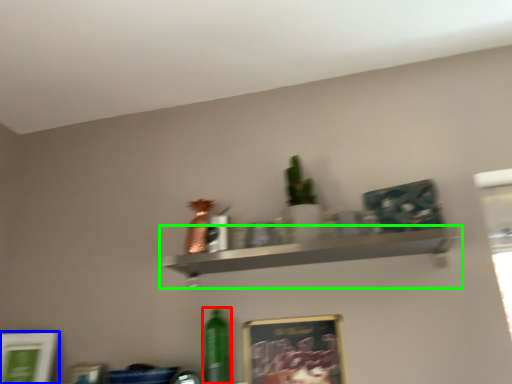
Question: Which object is the farthest from bottle (highlighted by a red box)? Choose among these: picture frame (highlighted by a blue box) or shelf (highlighted by a green box).

Choices:
 (A) picture frame
 (B) shelf

Answer: (A)